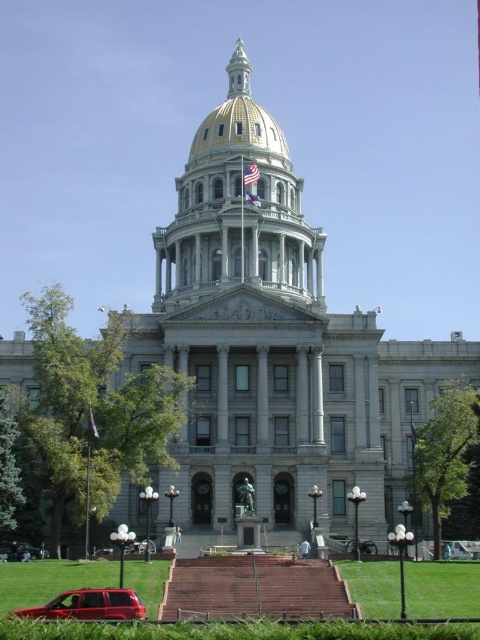
Is shiny red suv at lower left positioned behind white fabric flag at center?

No, shiny red suv at lower left is closer to the viewer.

Can you confirm if shiny red suv at lower left is positioned below white fabric flag at center?

Correct, shiny red suv at lower left is located below white fabric flag at center.

Is point (100, 596) positioned after point (254, 173)?

No, (100, 596) is in front of (254, 173).

Where is `shiny red suv at lower left`? The height and width of the screenshot is (640, 480). shiny red suv at lower left is located at coordinates (90, 605).

Is blue fabric flag at center to the right of silky fabric flag at center from the viewer's perspective?

Yes, blue fabric flag at center is to the right of silky fabric flag at center.

Image resolution: width=480 pixels, height=640 pixels. What do you see at coordinates (252, 198) in the screenshot? I see `blue fabric flag at center` at bounding box center [252, 198].

Is point (247, 192) positioned after point (90, 428)?

Yes, it is.

Identify the location of blue fabric flag at center. (252, 198).

Describe the element at coordinates (90, 605) in the screenshot. I see `shiny red suv at lower left` at that location.

What do you see at coordinates (90, 605) in the screenshot?
I see `shiny red suv at lower left` at bounding box center [90, 605].

The image size is (480, 640). I want to click on shiny red suv at lower left, so click(90, 605).